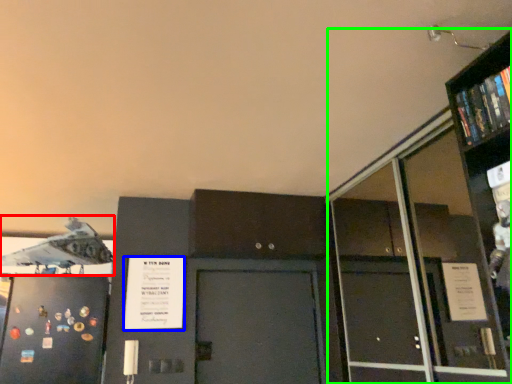
Question: Which object is positioned farthest from airplane (highlighted by a red box)? Select from poster (highlighted by a blue box) and bookcase (highlighted by a green box).

Choices:
 (A) poster
 (B) bookcase

Answer: (B)